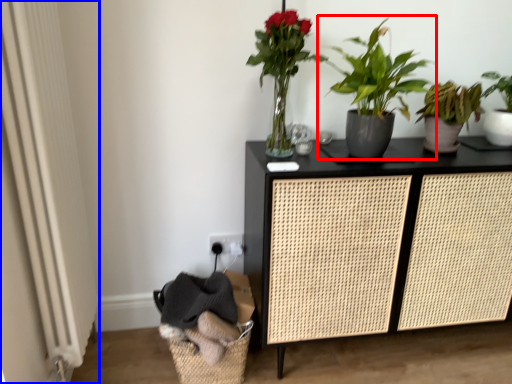
Question: Which of the following is the closest to the observer, houseplant (highlighted by a red box) or screen door (highlighted by a blue box)?

Choices:
 (A) houseplant
 (B) screen door

Answer: (B)